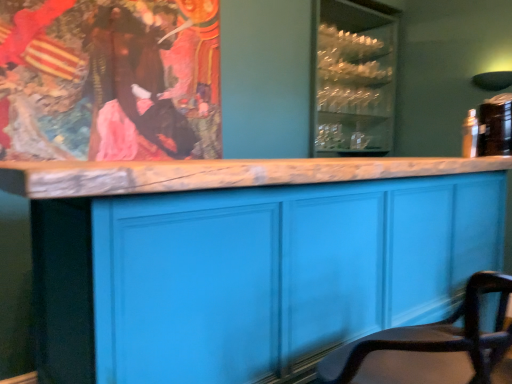
Question: From the image's perspective, is clear glass cabinet at upper center below matte blue cabinet at center?

Choices:
 (A) yes
 (B) no

Answer: (B)

Question: Can you confirm if clear glass cabinet at upper center is wider than matte blue cabinet at center?

Choices:
 (A) yes
 (B) no

Answer: (B)

Question: Is clear glass cabinet at upper center closer to camera compared to matte blue cabinet at center?

Choices:
 (A) yes
 (B) no

Answer: (B)

Question: From a real-world perspective, is clear glass cabinet at upper center positioned under matte blue cabinet at center based on gravity?

Choices:
 (A) yes
 (B) no

Answer: (B)

Question: Is clear glass cabinet at upper center shorter than matte blue cabinet at center?

Choices:
 (A) yes
 (B) no

Answer: (B)

Question: Would you say brown velvet robe at upper left is to the left or to the right of matte blue cabinet at center in the picture?

Choices:
 (A) left
 (B) right

Answer: (A)

Question: Is point (99, 11) positioned closer to the camera than point (473, 268)?

Choices:
 (A) closer
 (B) farther

Answer: (B)

Question: From the image's perspective, is brown velvet robe at upper left above or below matte blue cabinet at center?

Choices:
 (A) below
 (B) above

Answer: (B)

Question: From a real-world perspective, is brown velvet robe at upper left positioned above or below matte blue cabinet at center?

Choices:
 (A) below
 (B) above

Answer: (B)

Question: Considering the positions of smooth leather chair at lower right and matte blue cabinet at center in the image, is smooth leather chair at lower right taller or shorter than matte blue cabinet at center?

Choices:
 (A) short
 (B) tall

Answer: (A)

Question: Looking at their shapes, would you say smooth leather chair at lower right is wider or thinner than matte blue cabinet at center?

Choices:
 (A) wide
 (B) thin

Answer: (B)

Question: Based on their positions, is smooth leather chair at lower right located to the left or right of matte blue cabinet at center?

Choices:
 (A) right
 (B) left

Answer: (A)

Question: Considering their positions, is smooth leather chair at lower right located in front of or behind matte blue cabinet at center?

Choices:
 (A) behind
 (B) front

Answer: (B)

Question: Would you say smooth leather chair at lower right is to the left or to the right of brown velvet robe at upper left in the picture?

Choices:
 (A) right
 (B) left

Answer: (A)

Question: Based on their sizes in the image, would you say smooth leather chair at lower right is bigger or smaller than brown velvet robe at upper left?

Choices:
 (A) big
 (B) small

Answer: (A)